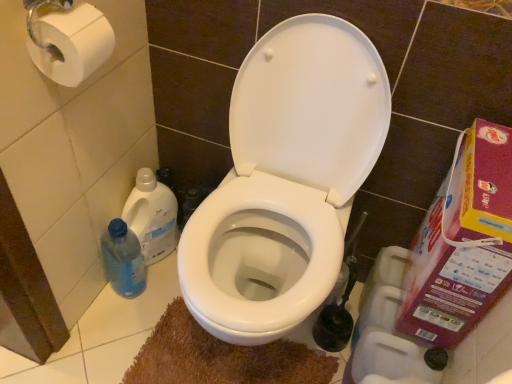
The width and height of the screenshot is (512, 384). What do you see at coordinates (69, 42) in the screenshot?
I see `white paper at upper left, which is counted as the 1th toilet paper, starting from the left` at bounding box center [69, 42].

I want to click on plastic cardboard box at right, so click(463, 242).

The width and height of the screenshot is (512, 384). Describe the element at coordinates (463, 242) in the screenshot. I see `plastic cardboard box at right` at that location.

Where is `white paper at upper left, which is the 1th toilet paper in top-to-bottom order`? white paper at upper left, which is the 1th toilet paper in top-to-bottom order is located at coordinates (69, 42).

Is plastic cardboard box at right directly adjacent to white paper at upper left, placed as the first toilet paper when sorted from front to back?

No, plastic cardboard box at right is not in contact with white paper at upper left, placed as the first toilet paper when sorted from front to back.

From the image's perspective, which is below, plastic cardboard box at right or white paper at upper left, which appears as the 2th toilet paper when ordered from the bottom?

From the image's view, plastic cardboard box at right is below.

Is plastic cardboard box at right positioned with its back to white paper at upper left, which appears as the 2th toilet paper when ordered from the bottom?

No, plastic cardboard box at right is not facing the opposite direction of white paper at upper left, which appears as the 2th toilet paper when ordered from the bottom.

Between plastic cardboard box at right and white paper at upper left, which is the 1th toilet paper in top-to-bottom order, which one is positioned in front?

white paper at upper left, which is the 1th toilet paper in top-to-bottom order, is in front.

Which object is closer to the camera taking this photo, white matte toilet paper at lower right, marked as the first toilet paper in a right-to-left arrangement, or blue translucent bottle at left, which ranks as the first cleaning product in bottom-to-top order?

white matte toilet paper at lower right, marked as the first toilet paper in a right-to-left arrangement.

Which object is wider, white matte toilet paper at lower right, marked as the first toilet paper in a right-to-left arrangement, or blue translucent bottle at left, which ranks as the first cleaning product in bottom-to-top order?

white matte toilet paper at lower right, marked as the first toilet paper in a right-to-left arrangement, is wider.

Looking at this image, does white matte toilet paper at lower right, the 2th toilet paper viewed from the front, have a lesser height compared to blue translucent bottle at left, which ranks as the first cleaning product in bottom-to-top order?

Indeed, white matte toilet paper at lower right, the 2th toilet paper viewed from the front, has a lesser height compared to blue translucent bottle at left, which ranks as the first cleaning product in bottom-to-top order.

From a real-world perspective, is white matte toilet paper at lower right, marked as the first toilet paper in a right-to-left arrangement, physically above blue translucent bottle at left, the second cleaning product from the top?

Yes.

Are translucent plastic bottle at lower left, which is the first cleaning product from top to bottom, and plastic cardboard box at right making contact?

translucent plastic bottle at lower left, which is the first cleaning product from top to bottom, is not next to plastic cardboard box at right, and they're not touching.

Identify the location of carton below the translucent plastic bottle at lower left, arranged as the 2th cleaning product when ordered from the bottom (from the image's perspective). The width and height of the screenshot is (512, 384). (463, 242).

Is translucent plastic bottle at lower left, which is the first cleaning product from top to bottom, looking in the opposite direction of plastic cardboard box at right?

translucent plastic bottle at lower left, which is the first cleaning product from top to bottom, does not have its back to plastic cardboard box at right.

From the image's perspective, which object appears higher, translucent plastic bottle at lower left, arranged as the 2th cleaning product when ordered from the bottom, or plastic cardboard box at right?

translucent plastic bottle at lower left, arranged as the 2th cleaning product when ordered from the bottom, is shown above in the image.

Looking at their sizes, would you say white matte toilet paper at lower right, positioned as the 2th toilet paper in left-to-right order, is wider or thinner than translucent plastic bottle at lower left, which is the first cleaning product from top to bottom?

white matte toilet paper at lower right, positioned as the 2th toilet paper in left-to-right order, is wider than translucent plastic bottle at lower left, which is the first cleaning product from top to bottom.

Considering the relative sizes of white matte toilet paper at lower right, the 1th toilet paper in the bottom-to-top sequence, and translucent plastic bottle at lower left, which is the first cleaning product from top to bottom, in the image provided, is white matte toilet paper at lower right, the 1th toilet paper in the bottom-to-top sequence, smaller than translucent plastic bottle at lower left, which is the first cleaning product from top to bottom,?

Indeed, white matte toilet paper at lower right, the 1th toilet paper in the bottom-to-top sequence, has a smaller size compared to translucent plastic bottle at lower left, which is the first cleaning product from top to bottom.

Is white matte toilet paper at lower right, the 1th toilet paper in the bottom-to-top sequence, oriented towards translucent plastic bottle at lower left, which is the first cleaning product from top to bottom?

No.

Is white matte toilet paper at lower right, positioned as the 2th toilet paper in left-to-right order, behind translucent plastic bottle at lower left, which is the first cleaning product from top to bottom?

No.

Can you confirm if brown plush bath mat at lower center is thinner than white paper at upper left, which is counted as the 1th toilet paper, starting from the left?

No.

Could you tell me if brown plush bath mat at lower center is turned towards white paper at upper left, marked as the second toilet paper in a back-to-front arrangement?

No, brown plush bath mat at lower center is not oriented towards white paper at upper left, marked as the second toilet paper in a back-to-front arrangement.

How different are the orientations of brown plush bath mat at lower center and white paper at upper left, the 2th toilet paper viewed from the right, in degrees?

brown plush bath mat at lower center and white paper at upper left, the 2th toilet paper viewed from the right, are facing 88.4 degrees away from each other.

Can you confirm if brown plush bath mat at lower center is taller than white paper at upper left, which is counted as the 1th toilet paper, starting from the left?

No.

Which of these two, white matte toilet paper at lower right, the 1th toilet paper in the bottom-to-top sequence, or white glossy toilet at center, is smaller?

With smaller size is white matte toilet paper at lower right, the 1th toilet paper in the bottom-to-top sequence.

What's the angular difference between white matte toilet paper at lower right, marked as the first toilet paper in a right-to-left arrangement, and white glossy toilet at center's facing directions?

The angle between the facing direction of white matte toilet paper at lower right, marked as the first toilet paper in a right-to-left arrangement, and the facing direction of white glossy toilet at center is 86.2 degrees.

Is white matte toilet paper at lower right, positioned as the 2th toilet paper in left-to-right order, facing away from white glossy toilet at center?

No, white glossy toilet at center is not at the back of white matte toilet paper at lower right, positioned as the 2th toilet paper in left-to-right order.

Which is less distant, (374, 346) or (286, 47)?

The point (286, 47) is in front.

Is white glossy toilet at center placed right next to translucent plastic bottle at lower left, which is the first cleaning product from top to bottom?

No.

Looking at this image, is translucent plastic bottle at lower left, which is the first cleaning product from top to bottom, at the back of white glossy toilet at center?

No, white glossy toilet at center is not facing the opposite direction of translucent plastic bottle at lower left, which is the first cleaning product from top to bottom.

Considering the positions of points (345, 67) and (144, 248), is point (345, 67) closer to camera compared to point (144, 248)?

That is True.

Which is more to the right, white glossy toilet at center or translucent plastic bottle at lower left, arranged as the 2th cleaning product when ordered from the bottom?

From the viewer's perspective, white glossy toilet at center appears more on the right side.

Find the location of a particular element. Image resolution: width=512 pixels, height=384 pixels. toilet paper that is the 2nd one when counting leftward from the plastic cardboard box at right is located at coordinates (69, 42).

Locate an element on the screen. This screenshot has width=512, height=384. cleaning product that is the 2nd object directly below the white matte toilet paper at lower right, the 2th toilet paper viewed from the front (from a real-world perspective) is located at coordinates (123, 260).

When comparing their distances from brown plush bath mat at lower center, does translucent plastic bottle at lower left, which is the first cleaning product from top to bottom, or white matte toilet paper at lower right, the 1th toilet paper in the bottom-to-top sequence, seem closer?

Based on the image, translucent plastic bottle at lower left, which is the first cleaning product from top to bottom, appears to be nearer to brown plush bath mat at lower center.

From the image, which object appears to be farther from brown plush bath mat at lower center, blue translucent bottle at left, which ranks as the first cleaning product in bottom-to-top order, or white paper at upper left, marked as the second toilet paper in a back-to-front arrangement?

white paper at upper left, marked as the second toilet paper in a back-to-front arrangement, is further to brown plush bath mat at lower center.

Considering their positions, is plastic cardboard box at right positioned closer to white paper at upper left, which appears as the 2th toilet paper when ordered from the bottom, than white glossy toilet at center?

white glossy toilet at center is positioned closer to the anchor white paper at upper left, which appears as the 2th toilet paper when ordered from the bottom.

From the picture: Looking at the image, which one is located further to plastic cardboard box at right, white glossy toilet at center or blue translucent bottle at left, the second cleaning product from the top?

blue translucent bottle at left, the second cleaning product from the top, is further to plastic cardboard box at right.

Based on their spatial positions, is white paper at upper left, which is the 1th toilet paper in top-to-bottom order, or plastic cardboard box at right closer to blue translucent bottle at left, which ranks as the first cleaning product in bottom-to-top order?

white paper at upper left, which is the 1th toilet paper in top-to-bottom order, lies closer to blue translucent bottle at left, which ranks as the first cleaning product in bottom-to-top order, than the other object.

Which object lies nearer to the anchor point translucent plastic bottle at lower left, arranged as the 2th cleaning product when ordered from the bottom, white paper at upper left, which is the 1th toilet paper in top-to-bottom order, or white matte toilet paper at lower right, positioned as the 2th toilet paper in left-to-right order?

Among the two, white paper at upper left, which is the 1th toilet paper in top-to-bottom order, is located nearer to translucent plastic bottle at lower left, arranged as the 2th cleaning product when ordered from the bottom.

Looking at the image, which one is located closer to white matte toilet paper at lower right, the 2th toilet paper viewed from the top, white paper at upper left, placed as the first toilet paper when sorted from front to back, or white glossy toilet at center?

Among the two, white glossy toilet at center is located nearer to white matte toilet paper at lower right, the 2th toilet paper viewed from the top.

Which object lies further to the anchor point blue translucent bottle at left, which ranks as the first cleaning product in bottom-to-top order, translucent plastic bottle at lower left, which is the first cleaning product from top to bottom, or brown plush bath mat at lower center?

brown plush bath mat at lower center is further to blue translucent bottle at left, which ranks as the first cleaning product in bottom-to-top order.

You are a GUI agent. You are given a task and a screenshot of the screen. Output one action in this format:
    pyautogui.click(x=<x>, y=<y>)
    Task: Click on the cleaning product between white glossy toilet at center and translucent plastic bottle at lower left, which is the first cleaning product from top to bottom, from front to back
    
    Given the screenshot: What is the action you would take?
    pyautogui.click(x=123, y=260)

I want to click on cleaning product between white paper at upper left, which is counted as the 1th toilet paper, starting from the left, and plastic cardboard box at right, in the horizontal direction, so click(152, 216).

Find the location of a particular element. The height and width of the screenshot is (384, 512). toilet paper between white glossy toilet at center and plastic cardboard box at right from left to right is located at coordinates (395, 357).

You are a GUI agent. You are given a task and a screenshot of the screen. Output one action in this format:
    pyautogui.click(x=<x>, y=<y>)
    Task: Click on the cleaning product between blue translucent bottle at left, which ranks as the first cleaning product in bottom-to-top order, and plastic cardboard box at right
    The width and height of the screenshot is (512, 384).
    Given the screenshot: What is the action you would take?
    pyautogui.click(x=152, y=216)